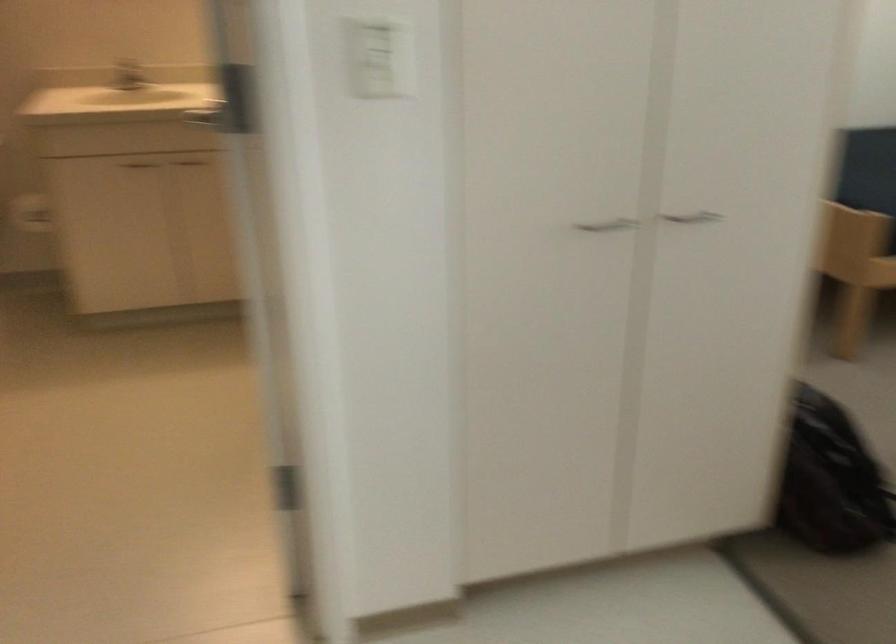
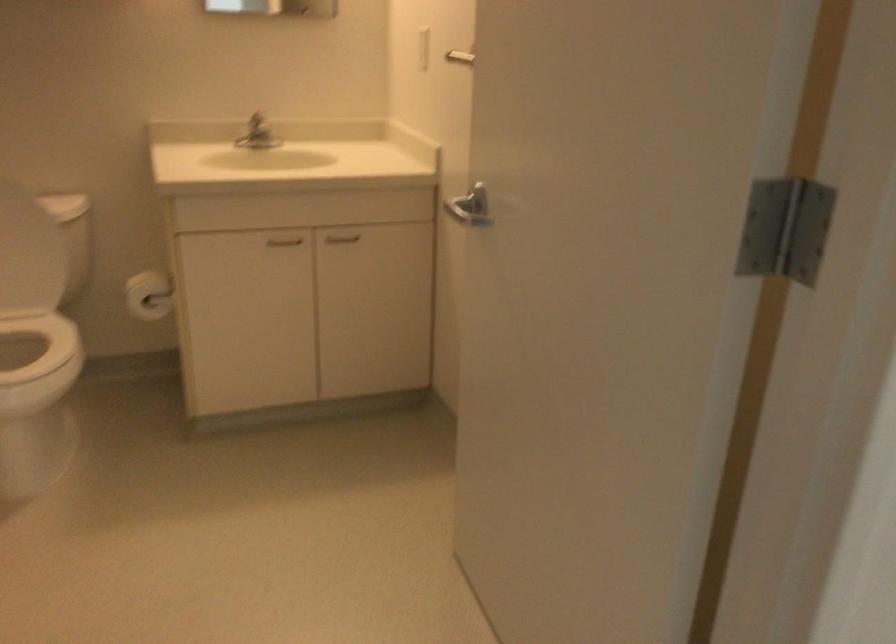
Where in the second image is the point corresponding to (119,78) from the first image?

(255, 133)